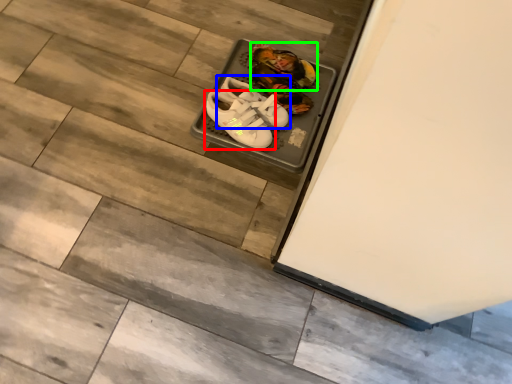
Question: Based on their relative distances, which object is farther from footwear (highlighted by a red box)? Choose from footwear (highlighted by a blue box) and footwear (highlighted by a green box).

Choices:
 (A) footwear
 (B) footwear

Answer: (B)